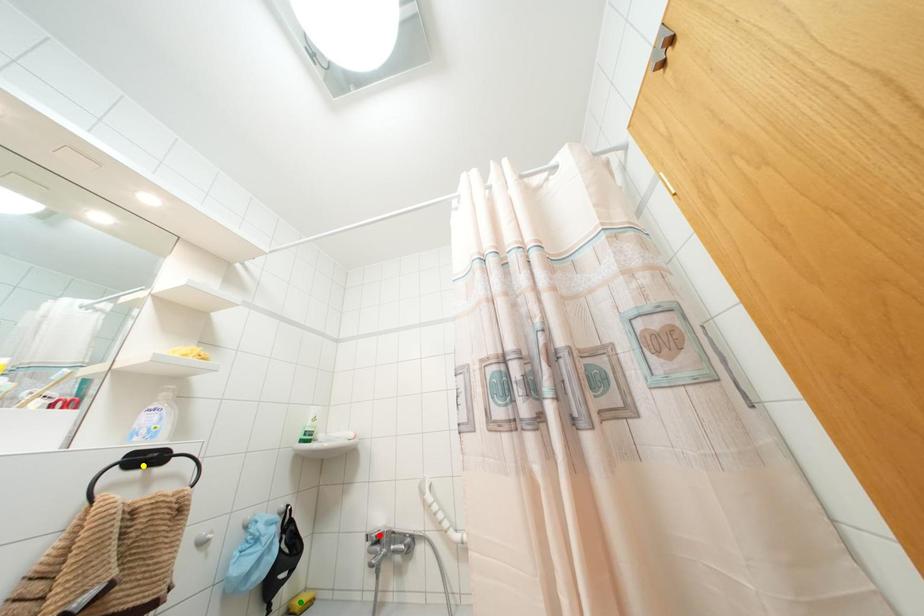
Order these from nearest to farthest:
green point | red point | yellow point

yellow point
green point
red point